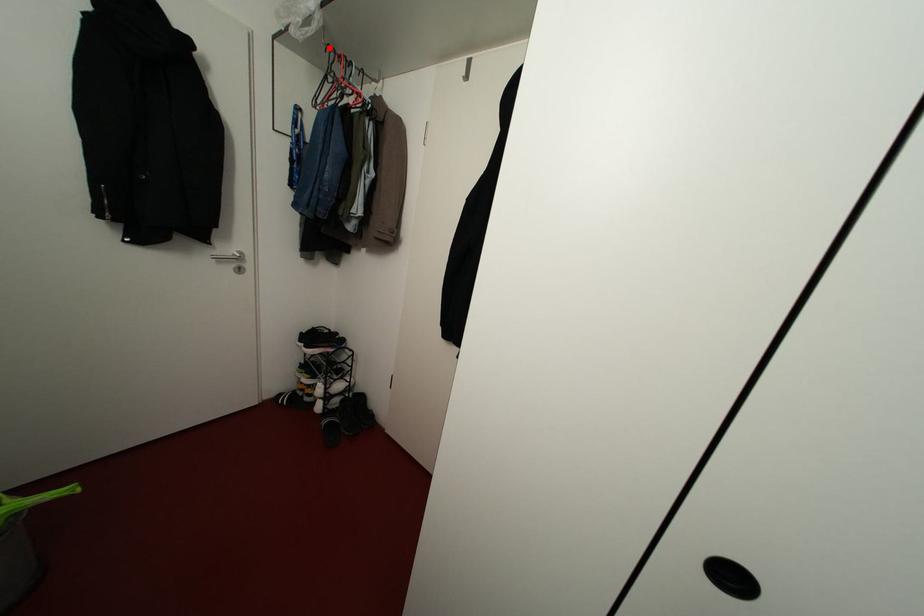
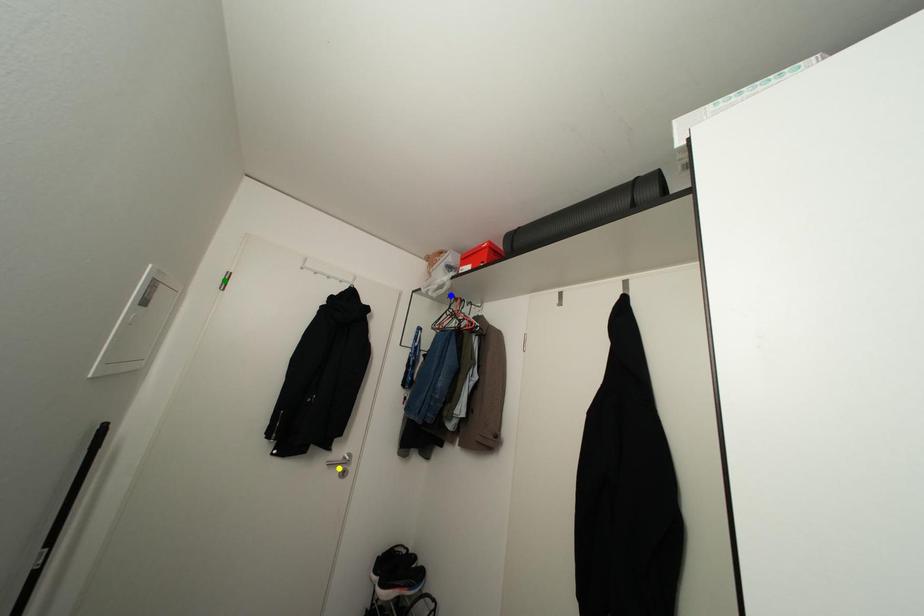
Question: I am providing you with two images of the same scene from different viewpoints. A red point is marked on the first image. You are given multiple points on the second image. In image 2, which mark is for the same physical point as the one in image 1?

Choices:
 (A) blue point
 (B) yellow point
 (C) green point

Answer: (A)